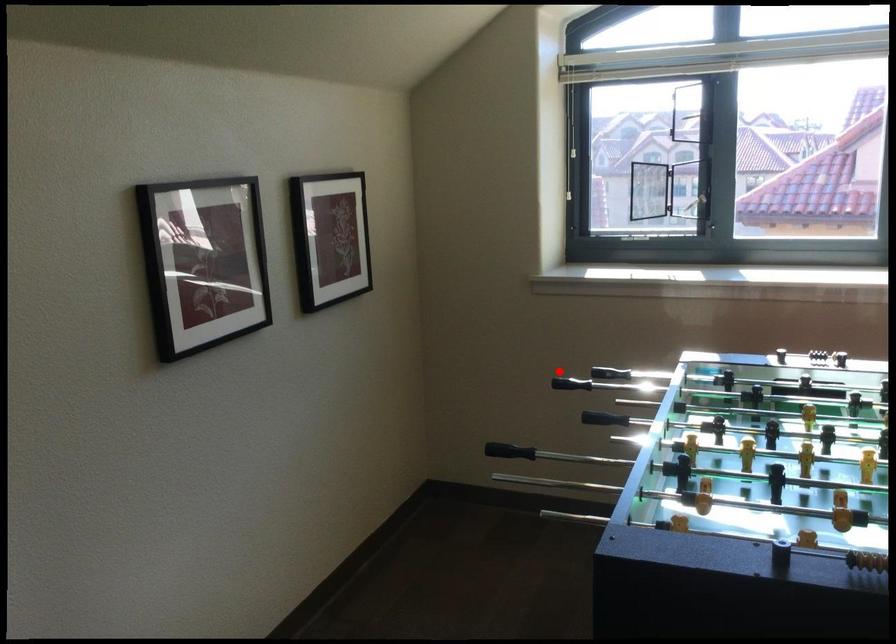
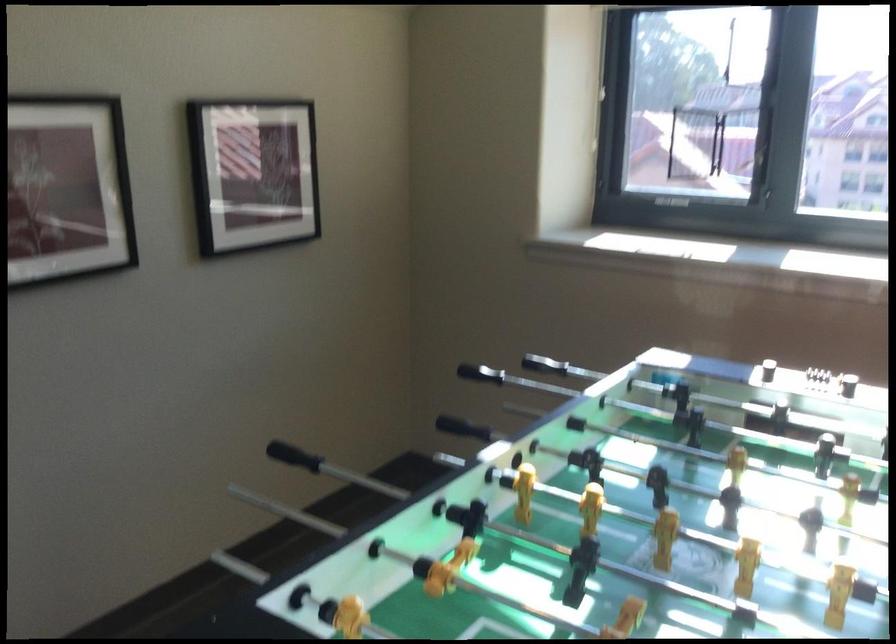
Question: I am providing you with two images of the same scene from different viewpoints. A red point is shown in image1. For the corresponding object point in image2, is it positioned nearer or farther from the camera?

Choices:
 (A) Nearer
 (B) Farther

Answer: (A)